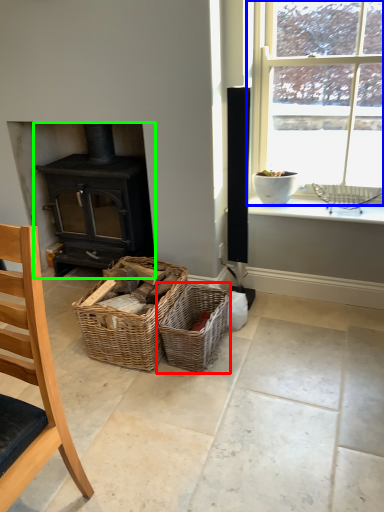
Question: Which object is the farthest from picnic basket (highlighted by a red box)? Choose among these: window (highlighted by a blue box) or wood burning stove (highlighted by a green box).

Choices:
 (A) window
 (B) wood burning stove

Answer: (A)